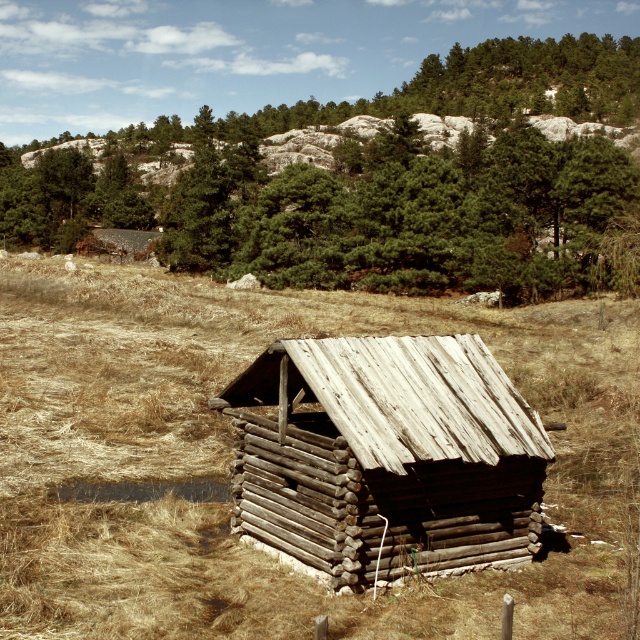
This screenshot has height=640, width=640. What are the coordinates of `brown dry grass at center` in the screenshot? It's located at (230, 458).

Image resolution: width=640 pixels, height=640 pixels. Identify the location of brown dry grass at center. (230, 458).

Which is below, green textured tree at upper center or weathered wood log cabin at center?

weathered wood log cabin at center

Between green textured tree at upper center and weathered wood log cabin at center, which one is positioned higher?

green textured tree at upper center is higher up.

Locate an element on the screen. The width and height of the screenshot is (640, 640). green textured tree at upper center is located at coordinates (387, 184).

Between brown dry grass at center and weathered wood log cabin at center, which one appears on the left side from the viewer's perspective?

Positioned to the left is brown dry grass at center.

Between point (538, 384) and point (454, 502), which one is positioned in front?

Point (454, 502) is more forward.

I want to click on brown dry grass at center, so click(x=230, y=458).